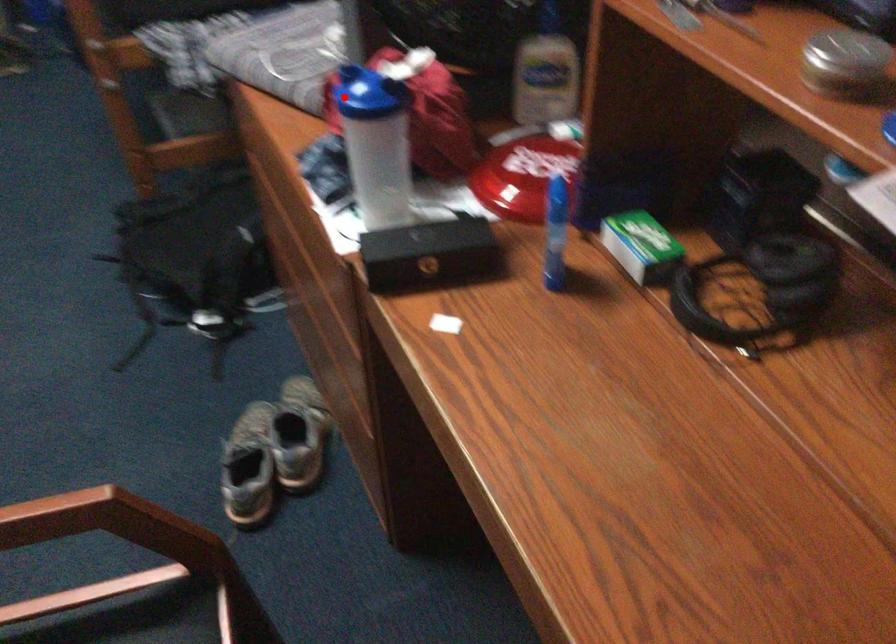
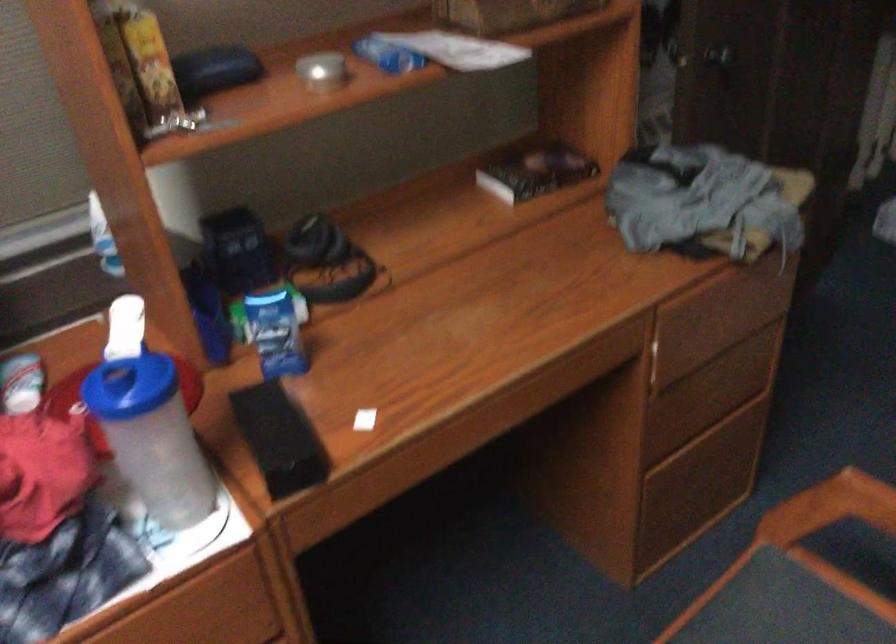
Where in the second image is the point corresponding to the highlighted location from the first image?

(130, 386)